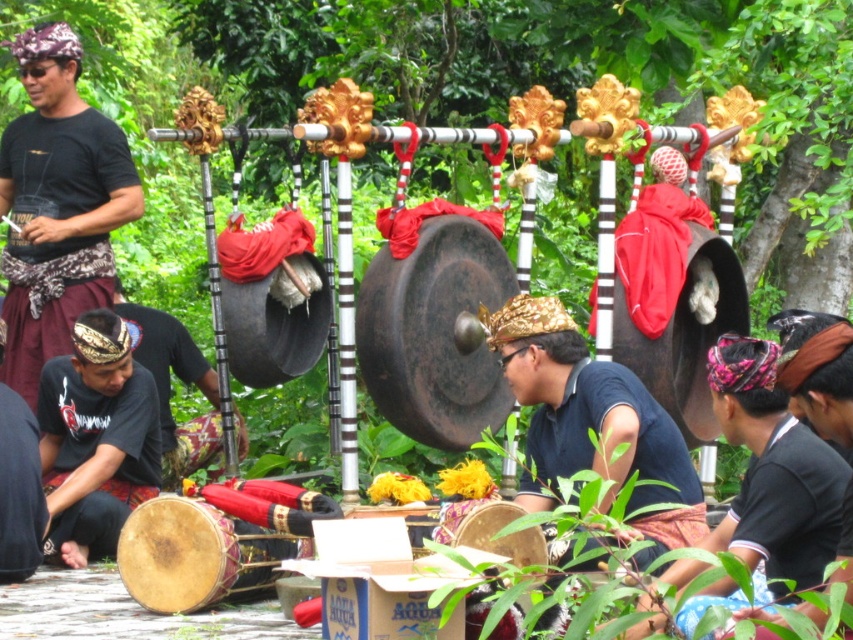
This screenshot has height=640, width=853. Find the location of `matte black shirt at left`. matte black shirt at left is located at coordinates (57, 204).

Can you confirm if matte black shirt at left is shorter than matte gold crown at center?

No, matte black shirt at left is not shorter than matte gold crown at center.

Between point (44, 337) and point (612, 486), which one is positioned in front?

Point (612, 486) is more forward.

Image resolution: width=853 pixels, height=640 pixels. I want to click on matte black shirt at left, so click(57, 204).

In the scene shown: Does dark blue shirt at center have a greater height compared to dark blue fabric at lower left?

No, dark blue shirt at center is not taller than dark blue fabric at lower left.

Between dark blue shirt at center and dark blue fabric at lower left, which one has less height?

dark blue shirt at center is shorter.

Locate an element on the screen. The width and height of the screenshot is (853, 640). dark blue shirt at center is located at coordinates (773, 468).

Which of these two, matte brown shirt at lower left or matte black drum at lower left, stands shorter?

With less height is matte brown shirt at lower left.

Which is below, matte brown shirt at lower left or matte black drum at lower left?

Positioned lower is matte brown shirt at lower left.

Which is behind, point (80, 416) or point (189, 337)?

The point (189, 337) is more distant.

I want to click on matte brown shirt at lower left, so click(x=96, y=438).